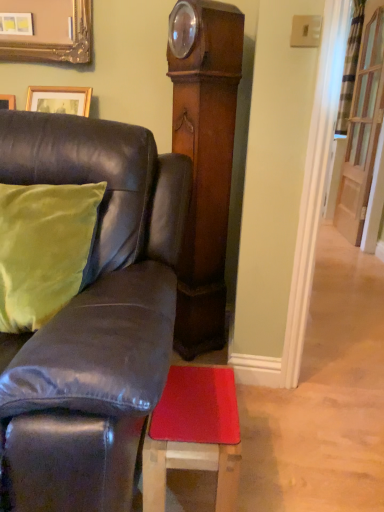
Describe the element at coordinates (92, 318) in the screenshot. The width and height of the screenshot is (384, 512). I see `leather couch at left` at that location.

The image size is (384, 512). What do you see at coordinates (363, 127) in the screenshot?
I see `clear glass door at upper right` at bounding box center [363, 127].

Image resolution: width=384 pixels, height=512 pixels. Identify the location of green velvet pillow at left. (43, 249).

I want to click on wooden grandfather clock at center, so click(x=204, y=160).

At what (x,y) coordinates should I click in order to perform the action: click on pillow that is on the left side of rubberized red mat at lower center. Please return your answer as a coordinate pair (x, y). Image resolution: width=384 pixels, height=512 pixels. Looking at the image, I should click on (43, 249).

Is green velvet pillow at left facing towards rubberized red mat at lower center?

No, green velvet pillow at left is not facing towards rubberized red mat at lower center.

Is point (7, 190) farther from camera compared to point (183, 386)?

Yes, it is behind point (183, 386).

Are clear glass door at upper right and leather couch at left far apart?

Yes, clear glass door at upper right is far from leather couch at left.

Between point (358, 100) and point (71, 407), which one is positioned behind?

The point (358, 100) is behind.

Which object is closer to the camera taking this photo, clear glass door at upper right or leather couch at left?

leather couch at left.

Consider the image. How much distance is there between clear glass door at upper right and leather couch at left?

clear glass door at upper right is 2.84 meters away from leather couch at left.

From a real-world perspective, relative to clear glass door at upper right, is wooden grandfather clock at center vertically above or below?

wooden grandfather clock at center is below clear glass door at upper right.

Does point (213, 8) come behind point (360, 77)?

No, it is not.

Does wooden grandfather clock at center have a lesser width compared to clear glass door at upper right?

In fact, wooden grandfather clock at center might be wider than clear glass door at upper right.

Measure the distance between wooden grandfather clock at center and clear glass door at upper right.

wooden grandfather clock at center is 2.32 meters from clear glass door at upper right.

What's the angular difference between clear glass door at upper right and green velvet pillow at left's facing directions?

86.7 degrees.

I want to click on pillow lying on the left of clear glass door at upper right, so click(43, 249).

Does clear glass door at upper right have a lesser width compared to green velvet pillow at left?

Correct, the width of clear glass door at upper right is less than that of green velvet pillow at left.

From the image's perspective, who appears lower, clear glass door at upper right or green velvet pillow at left?

green velvet pillow at left.

The width and height of the screenshot is (384, 512). I want to click on stool in front of the wooden grandfather clock at center, so click(x=194, y=434).

How many degrees apart are the facing directions of wooden grandfather clock at center and rubberized red mat at lower center?

The angular difference between wooden grandfather clock at center and rubberized red mat at lower center is 52.1 degrees.

From a real-world perspective, which object stands above the other?

wooden grandfather clock at center is physically above.

Is wooden grandfather clock at center looking in the opposite direction of rubberized red mat at lower center?

wooden grandfather clock at center does not have its back to rubberized red mat at lower center.

From a real-world perspective, between leather couch at left and green velvet pillow at left, who is vertically lower?

From a 3D spatial view, leather couch at left is below.

Is leather couch at left wider than green velvet pillow at left?

Yes.

Who is shorter, leather couch at left or green velvet pillow at left?

green velvet pillow at left.

Is leather couch at left in front of green velvet pillow at left?

Yes, the depth of leather couch at left is less than that of green velvet pillow at left.

From a real-world perspective, between rubberized red mat at lower center and clear glass door at upper right, who is vertically higher?

From a 3D spatial view, clear glass door at upper right is above.

Identify the location of stool below the clear glass door at upper right (from the image's perspective). (194, 434).

Which of these two, rubberized red mat at lower center or clear glass door at upper right, is bigger?

Bigger between the two is clear glass door at upper right.

Are rubberized red mat at lower center and clear glass door at upper right far apart?

rubberized red mat at lower center is positioned a significant distance from clear glass door at upper right.

Where is `pillow located above the rubberized red mat at lower center (from a real-world perspective)`? The height and width of the screenshot is (512, 384). pillow located above the rubberized red mat at lower center (from a real-world perspective) is located at coordinates (43, 249).

I want to click on furniture on the left of clear glass door at upper right, so click(92, 318).

From the image, which object appears to be farther from rubberized red mat at lower center, leather couch at left or wooden grandfather clock at center?

wooden grandfather clock at center.

From the image, which object appears to be farther from green velvet pillow at left, rubberized red mat at lower center or wooden grandfather clock at center?

The object further to green velvet pillow at left is wooden grandfather clock at center.

Estimate the real-world distances between objects in this image. Which object is further from leather couch at left, rubberized red mat at lower center or clear glass door at upper right?

clear glass door at upper right is positioned further to the anchor leather couch at left.

Considering their positions, is green velvet pillow at left positioned further to wooden grandfather clock at center than rubberized red mat at lower center?

rubberized red mat at lower center lies further to wooden grandfather clock at center than the other object.

Considering their positions, is wooden grandfather clock at center positioned closer to clear glass door at upper right than rubberized red mat at lower center?

wooden grandfather clock at center is positioned closer to the anchor clear glass door at upper right.

Based on their spatial positions, is green velvet pillow at left or leather couch at left further from wooden grandfather clock at center?

green velvet pillow at left.

Considering their positions, is leather couch at left positioned closer to wooden grandfather clock at center than rubberized red mat at lower center?

Based on the image, leather couch at left appears to be nearer to wooden grandfather clock at center.

Considering their positions, is rubberized red mat at lower center positioned further to clear glass door at upper right than wooden grandfather clock at center?

rubberized red mat at lower center is positioned further to the anchor clear glass door at upper right.

Find the location of a particular element. The image size is (384, 512). furniture between green velvet pillow at left and rubberized red mat at lower center in the vertical direction is located at coordinates (92, 318).

At what (x,y) coordinates should I click in order to perform the action: click on pillow between wooden grandfather clock at center and rubberized red mat at lower center in the up-down direction. Please return your answer as a coordinate pair (x, y). Looking at the image, I should click on (43, 249).

The width and height of the screenshot is (384, 512). Find the location of `pillow between leather couch at left and clear glass door at upper right from front to back`. pillow between leather couch at left and clear glass door at upper right from front to back is located at coordinates coord(43,249).

Where is `stool between green velvet pillow at left and clear glass door at upper right along the z-axis`? stool between green velvet pillow at left and clear glass door at upper right along the z-axis is located at coordinates (194, 434).